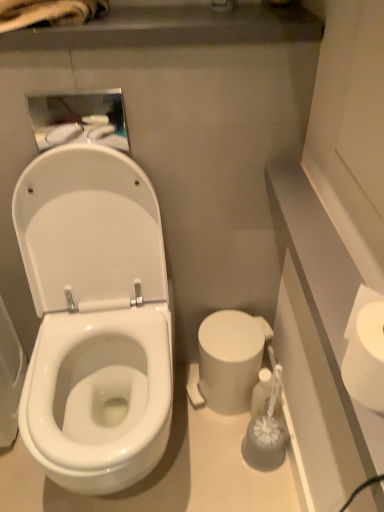
Looking at this image, measure the distance between white glossy medicine cabinet at upper left and camera.

They are 93.36 centimeters apart.

What do you see at coordinates (95, 319) in the screenshot? I see `white glossy toilet at left` at bounding box center [95, 319].

Locate an element on the screen. Image resolution: width=384 pixels, height=512 pixels. white glossy medicine cabinet at upper left is located at coordinates (79, 119).

Is white matte toilet paper at right positioned before white glossy medicine cabinet at upper left?

Yes, it is in front of white glossy medicine cabinet at upper left.

Is white matte toilet paper at right directly adjacent to white glossy medicine cabinet at upper left?

white matte toilet paper at right and white glossy medicine cabinet at upper left are clearly separated.

From the image's perspective, between white matte toilet paper at right and white glossy medicine cabinet at upper left, who is located below?

From the image's view, white matte toilet paper at right is below.

Looking at their sizes, would you say white matte toilet paper at right is wider or thinner than white glossy medicine cabinet at upper left?

In the image, white matte toilet paper at right appears to be wider than white glossy medicine cabinet at upper left.

From a real-world perspective, who is located higher, white matte toilet paper at right or translucent plastic brush at lower right?

white matte toilet paper at right.

Can you tell me how much white matte toilet paper at right and translucent plastic brush at lower right differ in facing direction?

Answer: 90 degrees.

Which point is more forward, (x=359, y=317) or (x=253, y=413)?

Positioned in front is point (x=359, y=317).

Which object is closer to the camera taking this photo, white matte toilet paper at right or translucent plastic brush at lower right?

white matte toilet paper at right is more forward.

Would you say translucent plastic brush at lower right is to the left or to the right of white glossy medicine cabinet at upper left in the picture?

In the image, translucent plastic brush at lower right appears on the right side of white glossy medicine cabinet at upper left.

Is translucent plastic brush at lower right facing towards white glossy medicine cabinet at upper left?

No, translucent plastic brush at lower right does not turn towards white glossy medicine cabinet at upper left.

Between translucent plastic brush at lower right and white glossy medicine cabinet at upper left, which one has larger width?

translucent plastic brush at lower right is wider.

From the picture: Is translucent plastic brush at lower right smaller than white glossy medicine cabinet at upper left?

No, translucent plastic brush at lower right is not smaller than white glossy medicine cabinet at upper left.

Is white matte toilet paper at right positioned far away from white glossy toilet at left?

No, white matte toilet paper at right is in close proximity to white glossy toilet at left.

In the scene shown: From a real-world perspective, relative to white glossy toilet at left, is white matte toilet paper at right vertically above or below?

white matte toilet paper at right is situated higher than white glossy toilet at left in the real world.

You are a GUI agent. You are given a task and a screenshot of the screen. Output one action in this format:
    pyautogui.click(x=<x>, y=<y>)
    Task: Click on the wide on the left of white matte toilet paper at right
    The width and height of the screenshot is (384, 512).
    Given the screenshot: What is the action you would take?
    pyautogui.click(x=95, y=319)

Which is more to the right, white matte toilet paper at right or white glossy toilet at left?

→ Positioned to the right is white matte toilet paper at right.

Does white glossy medicine cabinet at upper left touch white matte toilet paper at right?

No, white glossy medicine cabinet at upper left is not with white matte toilet paper at right.

Which object is closer to the camera, white glossy medicine cabinet at upper left or white matte toilet paper at right?

white matte toilet paper at right is more forward.

From a real-world perspective, which is physically below, white glossy medicine cabinet at upper left or white matte toilet paper at right?

white matte toilet paper at right is physically lower.

Does white glossy medicine cabinet at upper left have a lesser height compared to white matte toilet paper at right?

Incorrect, the height of white glossy medicine cabinet at upper left does not fall short of that of white matte toilet paper at right.

How many degrees apart are the facing directions of white glossy toilet at left and white matte toilet paper at right?

90 degrees.

Consider the image. Measure the distance between white glossy toilet at left and white matte toilet paper at right.

A distance of 27.94 inches exists between white glossy toilet at left and white matte toilet paper at right.

In the image, is white glossy toilet at left on the left side or the right side of white matte toilet paper at right?

Clearly, white glossy toilet at left is on the left of white matte toilet paper at right in the image.

Can you confirm if white glossy toilet at left is thinner than white matte toilet paper at right?

In fact, white glossy toilet at left might be wider than white matte toilet paper at right.

Measure the distance from translucent plastic brush at lower right to white matte toilet paper at right.

translucent plastic brush at lower right and white matte toilet paper at right are 27.17 inches apart from each other.

Consider the image. Considering the relative positions of translucent plastic brush at lower right and white matte toilet paper at right in the image provided, is translucent plastic brush at lower right to the right of white matte toilet paper at right from the viewer's perspective?

Incorrect, translucent plastic brush at lower right is not on the right side of white matte toilet paper at right.

Is translucent plastic brush at lower right facing away from white matte toilet paper at right?

translucent plastic brush at lower right is not turned away from white matte toilet paper at right.

What's the angular difference between translucent plastic brush at lower right and white matte toilet paper at right's facing directions?

90 degrees separate the facing orientations of translucent plastic brush at lower right and white matte toilet paper at right.

Find the location of a particular element. The image size is (384, 512). medicine cabinet above the white matte toilet paper at right (from a real-world perspective) is located at coordinates (79, 119).

Locate an element on the screen. toiletry on the left side of white matte toilet paper at right is located at coordinates (262, 393).

When comparing their distances from white glossy medicine cabinet at upper left, does white matte toilet paper at right or translucent plastic brush at lower right seem further?

translucent plastic brush at lower right lies further to white glossy medicine cabinet at upper left than the other object.

Considering their positions, is translucent plastic brush at lower right positioned further to white glossy toilet at left than white matte toilet paper at right?

The object further to white glossy toilet at left is white matte toilet paper at right.

Looking at the image, which one is located closer to white glossy medicine cabinet at upper left, white matte toilet paper at right or white glossy toilet at left?

white glossy toilet at left.

From the image, which object appears to be nearer to white glossy toilet at left, white matte toilet paper at right or white glossy medicine cabinet at upper left?

Among the two, white glossy medicine cabinet at upper left is located nearer to white glossy toilet at left.

From the image, which object appears to be farther from white matte toilet paper at right, translucent plastic brush at lower right or white glossy toilet at left?

The object further to white matte toilet paper at right is white glossy toilet at left.

Estimate the real-world distances between objects in this image. Which object is further from white matte toilet paper at right, white glossy medicine cabinet at upper left or translucent plastic brush at lower right?

The object further to white matte toilet paper at right is white glossy medicine cabinet at upper left.

When comparing their distances from white glossy medicine cabinet at upper left, does translucent plastic brush at lower right or white glossy toilet at left seem closer?

The object closer to white glossy medicine cabinet at upper left is white glossy toilet at left.

Based on their spatial positions, is translucent plastic brush at lower right or white matte toilet paper at right further from white glossy medicine cabinet at upper left?

Based on the image, translucent plastic brush at lower right appears to be further to white glossy medicine cabinet at upper left.

Locate an element on the screen. toilet paper between white glossy medicine cabinet at upper left and white glossy toilet at left in the up-down direction is located at coordinates (365, 356).

You are a GUI agent. You are given a task and a screenshot of the screen. Output one action in this format:
    pyautogui.click(x=<x>, y=<y>)
    Task: Click on the medicine cabinet between white matte toilet paper at right and translucent plastic brush at lower right in the front-back direction
    The height and width of the screenshot is (512, 384).
    Given the screenshot: What is the action you would take?
    pyautogui.click(x=79, y=119)

At what (x,y) coordinates should I click in order to perform the action: click on wide between white matte toilet paper at right and translucent plastic brush at lower right along the z-axis. Please return your answer as a coordinate pair (x, y). The height and width of the screenshot is (512, 384). Looking at the image, I should click on (95, 319).

At what (x,y) coordinates should I click in order to perform the action: click on wide between white glossy medicine cabinet at upper left and translucent plastic brush at lower right in the vertical direction. Please return your answer as a coordinate pair (x, y). The width and height of the screenshot is (384, 512). Looking at the image, I should click on (95, 319).